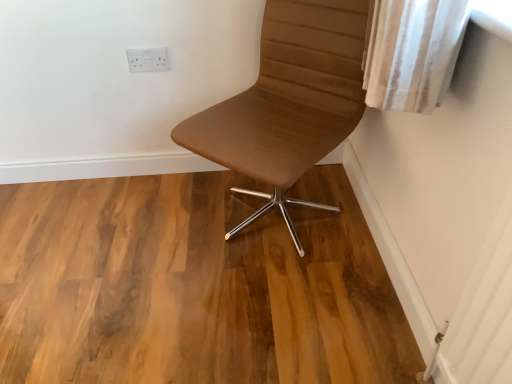
Identify the location of free location in front of brown leather chair at center. (272, 309).